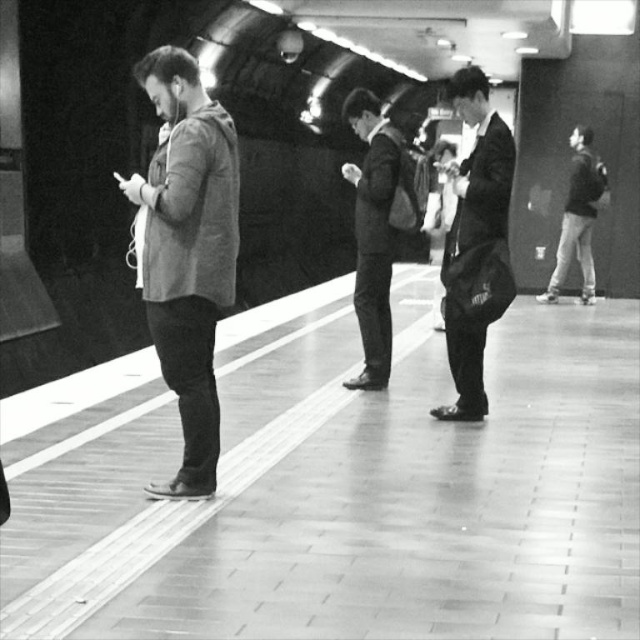
Question: Among these points, which one is nearest to the camera?

Choices:
 (A) 568,141
 (B) 148,173

Answer: (B)

Question: From the image, what is the correct spatial relationship of smooth black suit at right in relation to dark gray backpack at right?

Choices:
 (A) above
 (B) below

Answer: (B)

Question: In this image, where is light gray hoodie at center located relative to smooth black suit at right?

Choices:
 (A) left
 (B) right

Answer: (A)

Question: In this image, where is light gray hoodie at center located relative to dark suit at center?

Choices:
 (A) right
 (B) left

Answer: (B)

Question: Which of the following is the closest to the observer?

Choices:
 (A) light gray hoodie at center
 (B) smooth black suit at right
 (C) dark gray backpack at right
 (D) dark suit at center

Answer: (A)

Question: Considering the real-world distances, which object is farthest from the dark gray backpack at right?

Choices:
 (A) dark suit at center
 (B) smooth black suit at right

Answer: (B)